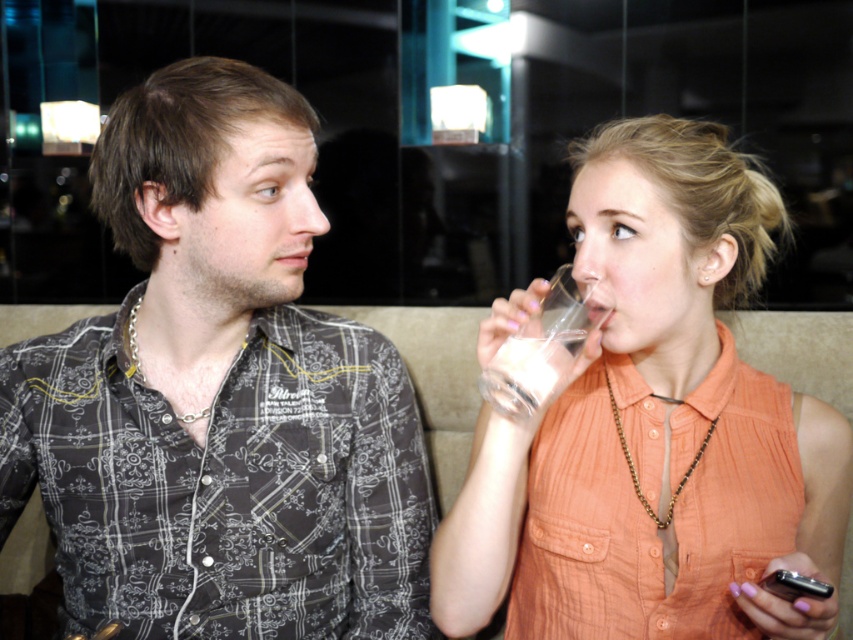
Question: Which point appears farthest from the camera in this image?

Choices:
 (A) (521, 355)
 (B) (689, 182)
 (C) (223, 161)

Answer: (C)

Question: Which object is the farthest from the matte orange shirt at right?

Choices:
 (A) clear glass at upper right
 (B) patterned fabric shirt at center

Answer: (B)

Question: Observing the image, what is the correct spatial positioning of patterned fabric shirt at center in reference to clear glass at upper right?

Choices:
 (A) right
 (B) left

Answer: (B)

Question: Is patterned fabric shirt at center to the right of matte orange shirt at right from the viewer's perspective?

Choices:
 (A) no
 (B) yes

Answer: (A)

Question: Which point is closer to the camera taking this photo?

Choices:
 (A) (610, 230)
 (B) (575, 340)
 (C) (225, 436)

Answer: (B)

Question: Considering the relative positions of matte orange shirt at right and clear glass at upper right in the image provided, where is matte orange shirt at right located with respect to clear glass at upper right?

Choices:
 (A) right
 (B) left

Answer: (A)